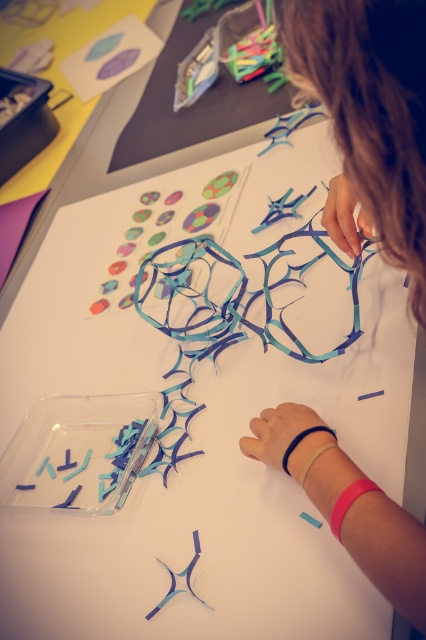
Question: Does teal matte plastic at center appear under translucent blue plastic at center?

Choices:
 (A) no
 (B) yes

Answer: (A)

Question: Which of the following is the farthest from the observer?

Choices:
 (A) (92, 83)
 (B) (172, 573)

Answer: (A)

Question: Which object is positioned closest to the matte purple paper at upper left?

Choices:
 (A) translucent blue plastic at center
 (B) teal matte plastic at center

Answer: (B)

Question: Which of the following is the closest to the observer?

Choices:
 (A) (203, 602)
 (B) (367, 24)
 (C) (83, 70)

Answer: (B)

Question: Does teal matte plastic at center have a smaller size compared to translucent blue plastic at center?

Choices:
 (A) yes
 (B) no

Answer: (B)

Question: Is matte purple paper at upper left thinner than translucent blue plastic at center?

Choices:
 (A) no
 (B) yes

Answer: (A)